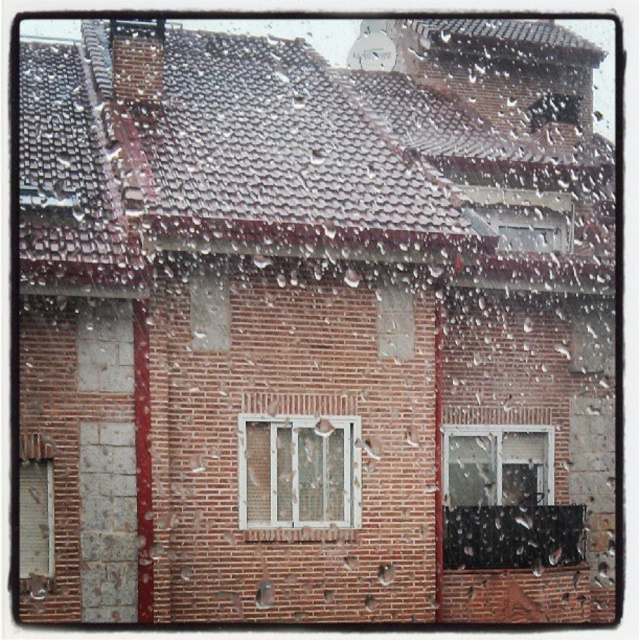
Question: Which object appears farthest from the camera in this image?

Choices:
 (A) white plastic window at center
 (B) clear glass window at center

Answer: (B)

Question: Where is white plastic window at center located in relation to clear glass window at center in the image?

Choices:
 (A) right
 (B) left

Answer: (B)

Question: From the image, what is the correct spatial relationship of white plastic window at center in relation to clear glass window at center?

Choices:
 (A) right
 (B) left

Answer: (B)

Question: Does white plastic window at center appear over clear glass window at center?

Choices:
 (A) yes
 (B) no

Answer: (A)

Question: Among these points, which one is nearest to the camera?

Choices:
 (A) (448, 440)
 (B) (244, 461)

Answer: (B)

Question: Which of the following is the farthest from the observer?

Choices:
 (A) white plastic window at center
 (B) clear glass window at center

Answer: (B)